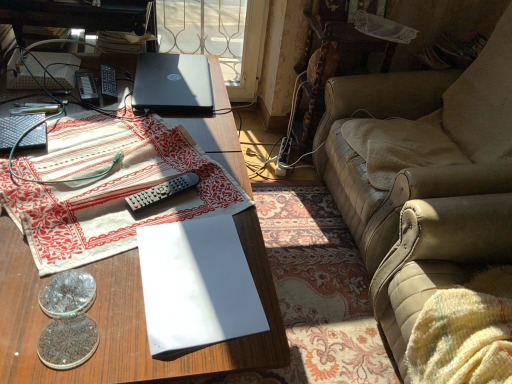
Locate an element on the screen. The height and width of the screenshot is (384, 512). blank area to the left of white paper at center, which is counted as the second paperback book, starting from the left is located at coordinates (86, 250).